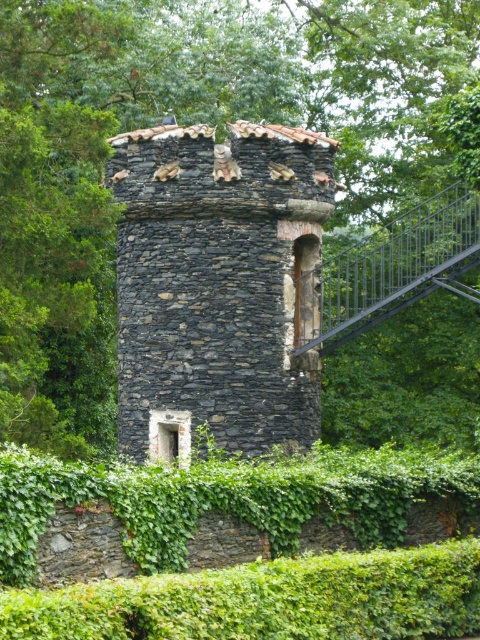
You are standing in front of the rustic stone tower at center and notice a green leafy tree at center. Which object is closer to you?

The green leafy tree at center is closer to the viewer than the rustic stone tower at center.

You are standing at the base of the quaint stone tower and want to take a photo of the point labeled as point (x=380, y=346). Given that your camera has a maximum focus range of 300 feet, will you be able to capture it clearly?

The point (x=380, y=346) is 285.51 feet from the camera, which is within the maximum focus range of 300 feet. Therefore, you can capture it clearly.